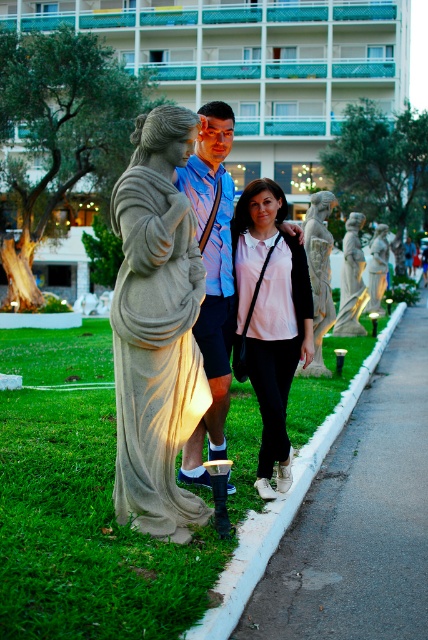
Does stone statue at left appear under stone statue at center?

Indeed, stone statue at left is positioned under stone statue at center.

Which is above, stone statue at left or stone statue at center?

Positioned higher is stone statue at center.

Identify the location of stone statue at left. The image size is (428, 640). (157, 330).

Does stone statue at center have a lesser width compared to matte gray statue at center?

Correct, stone statue at center's width is less than matte gray statue at center's.

Can you confirm if stone statue at center is shorter than matte gray statue at center?

No, stone statue at center is not shorter than matte gray statue at center.

Does point (315, 300) come in front of point (371, 243)?

Yes.

In order to click on stone statue at center in this screenshot , I will do pyautogui.click(x=318, y=275).

Is stone statue at left further to the viewer compared to matte stone statue at center?

No.

Between point (122, 234) and point (222, 140), which one is positioned in front?

Positioned in front is point (122, 234).

Locate an element on the screen. The width and height of the screenshot is (428, 640). stone statue at left is located at coordinates (157, 330).